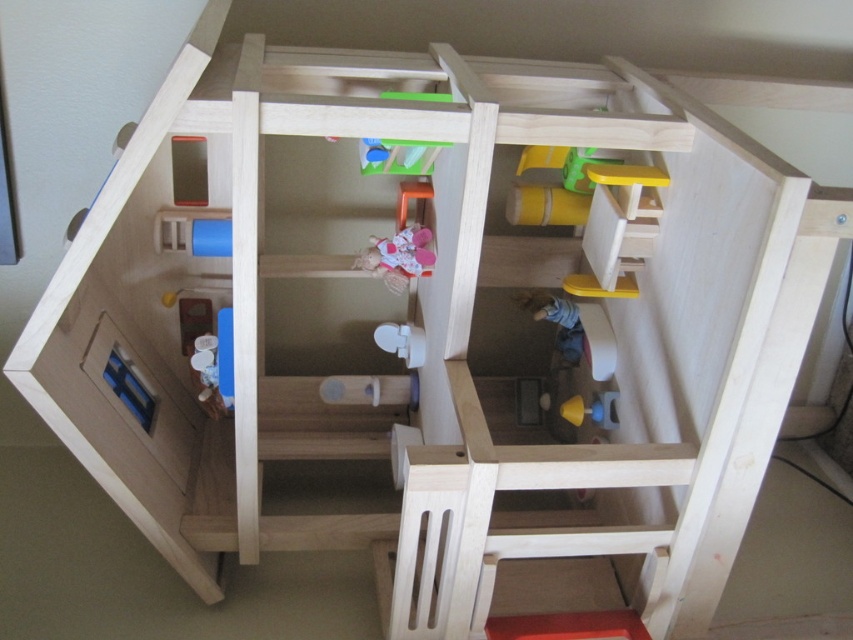
This screenshot has height=640, width=853. In order to click on smooth red stool at lower center in this screenshot , I will do `click(567, 625)`.

Does smooth red stool at lower center lie behind smooth plastic spoon at upper center?

Yes, smooth red stool at lower center is further from the viewer.

Is point (515, 628) farther from camera compared to point (426, 172)?

No, it is in front of (426, 172).

I want to click on smooth red stool at lower center, so 567,625.

Which is in front, point (396, 232) or point (387, 140)?

Point (387, 140)

Between point (419, 275) and point (380, 147), which one is positioned behind?

Point (419, 275)

Does point (405, 250) lie in front of point (430, 97)?

No, it is behind (430, 97).

Find the location of `matte pink doll at center`. matte pink doll at center is located at coordinates (398, 257).

Measure the distance between smooth plastic spoon at upper center and smooth yellow cup at center.

smooth plastic spoon at upper center is 18.22 inches away from smooth yellow cup at center.

Does smooth plastic spoon at upper center lie in front of smooth yellow cup at center?

Yes.

What do you see at coordinates (398, 156) in the screenshot? I see `smooth plastic spoon at upper center` at bounding box center [398, 156].

I want to click on smooth plastic spoon at upper center, so click(x=398, y=156).